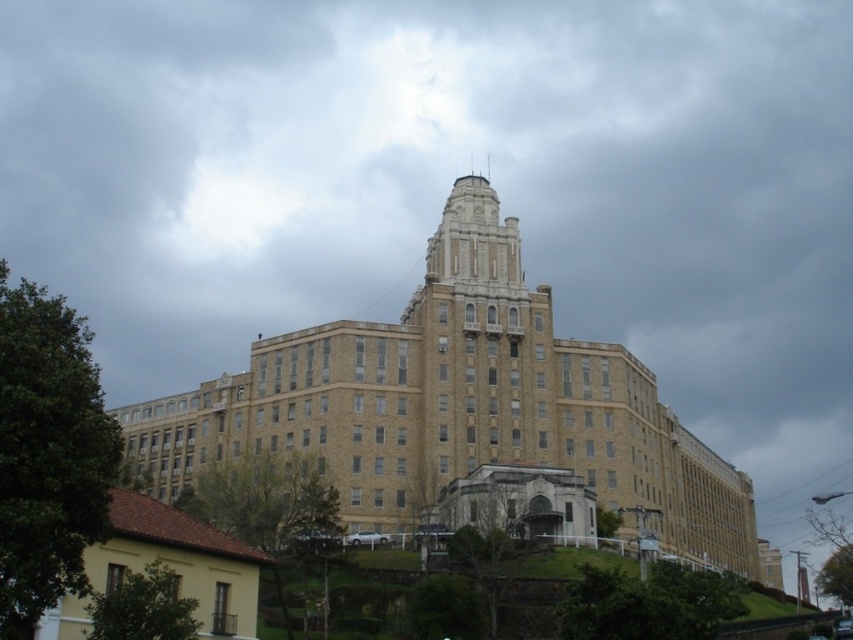
Question: Is beige stone building at center wider than yellow matte house at lower left?

Choices:
 (A) no
 (B) yes

Answer: (B)

Question: Which point is farther to the camera?

Choices:
 (A) beige stone building at center
 (B) yellow matte house at lower left

Answer: (A)

Question: Observing the image, what is the correct spatial positioning of beige stone building at center in reference to yellow matte house at lower left?

Choices:
 (A) left
 (B) right

Answer: (B)

Question: Among these points, which one is nearest to the camera?

Choices:
 (A) click(68, 628)
 (B) click(686, 544)

Answer: (A)

Question: Which point is farther from the camera taking this photo?

Choices:
 (A) (216, 634)
 (B) (265, 342)

Answer: (B)

Question: Does beige stone building at center lie behind yellow matte house at lower left?

Choices:
 (A) no
 (B) yes

Answer: (B)